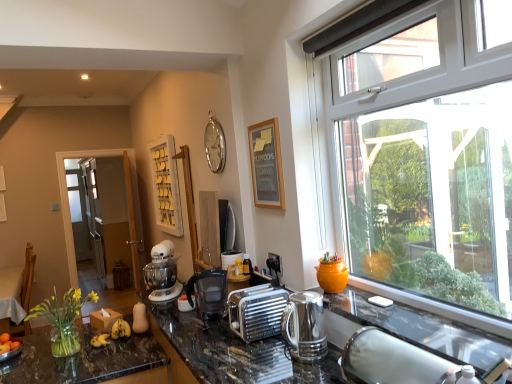
Locate an element on the screen. free space above white plastic window at right (from a real-world perspective) is located at coordinates (388, 28).